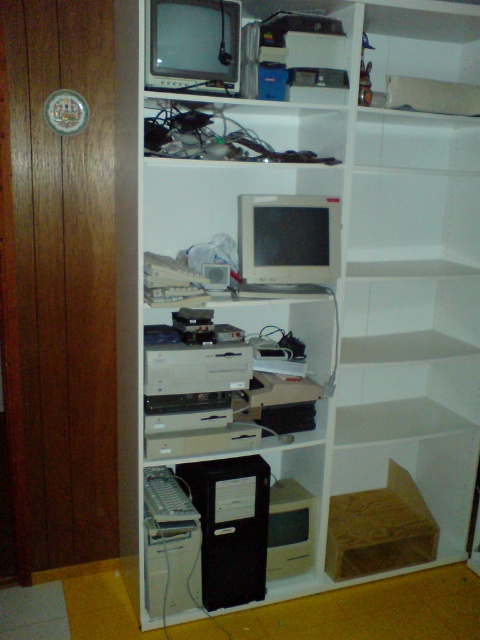
You are a delivery person who needs to place a camera on the floor near the white matte bookshelf at center. The camera requires a minimum of 6 feet of space to avoid damaging nearby items. Can you safely place the camera there?

The white matte bookshelf at center and camera are 5.95 feet apart from each other, which is less than the required 6 feet. Therefore, placing the camera there may risk damaging the white matte bookshelf at center.

You are a warehouse worker who needs to place a new item on the shelving unit. The shelving unit has two specific points marked for potential placement. The first point is at coordinates point (252, 596) and the second is at point (256, 256). Which of these points is closer to the back of the shelving unit?

Point (252, 596) is behind point (256, 256), so the first point is closer to the back of the shelving unit.

You are an employee at a tech store and need to place a new computer tower that is 18 inches wide into the shelving unit. The black plastic computer tower at center and the matte gray monitor at center are already occupying space. Can you fit the new tower between them?

The black plastic computer tower at center is 35.33 inches from matte gray monitor at center. Since the new tower is only 18 inches wide, there is enough space between them to fit the new tower as 35.33 inches is greater than 18 inches.